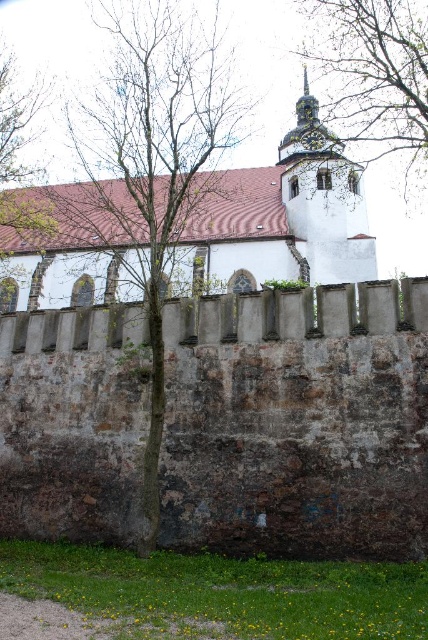
Question: Based on their relative distances, which object is farther from the green leafy tree at upper right?

Choices:
 (A) brown bark tree at center
 (B) green leafy tree at left

Answer: (B)

Question: Among these points, which one is farthest from the camera?

Choices:
 (A) (211, 84)
 (B) (53, 304)

Answer: (A)

Question: Which object is positioned closest to the green leafy tree at left?

Choices:
 (A) green leafy tree at upper right
 (B) white stone church at upper center
 (C) brown bark tree at center

Answer: (C)

Question: Where is brown bark tree at center located in relation to green leafy tree at upper right in the image?

Choices:
 (A) right
 (B) left

Answer: (B)

Question: Is the position of green leafy tree at upper right less distant than that of green leafy tree at left?

Choices:
 (A) no
 (B) yes

Answer: (B)

Question: Is white stone church at upper center positioned behind green leafy tree at upper right?

Choices:
 (A) yes
 (B) no

Answer: (A)